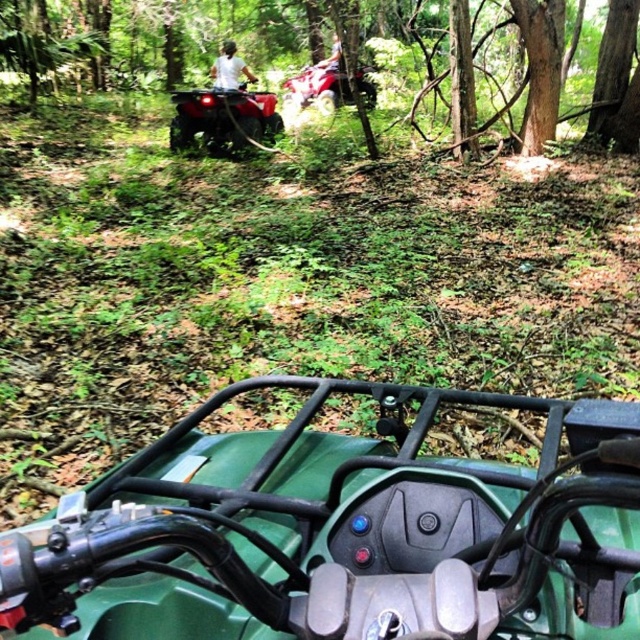
Question: Is brown rough tree trunk at upper center to the right of white matte shirt at upper center from the viewer's perspective?

Choices:
 (A) no
 (B) yes

Answer: (B)

Question: Which object appears closest to the camera in this image?

Choices:
 (A) white matte shirt at upper center
 (B) brown rough tree trunk at upper center
 (C) matte red quad bike at center

Answer: (B)

Question: Which object appears closest to the camera in this image?

Choices:
 (A) smooth bark tree at upper right
 (B) brown rough tree trunk at upper center
 (C) white matte shirt at upper center

Answer: (B)

Question: Based on their relative distances, which object is farther from the green matte quad bike at center?

Choices:
 (A) smooth bark tree at upper right
 (B) white matte shirt at upper center
 (C) matte red quad bike at center
 (D) brown rough tree trunk at upper center

Answer: (B)

Question: Where is green matte quad bike at center located in relation to smooth bark tree at upper right in the image?

Choices:
 (A) above
 (B) below

Answer: (B)

Question: Can you confirm if brown rough tree trunk at upper center is positioned to the left of matte red quad bike at center?

Choices:
 (A) no
 (B) yes

Answer: (A)